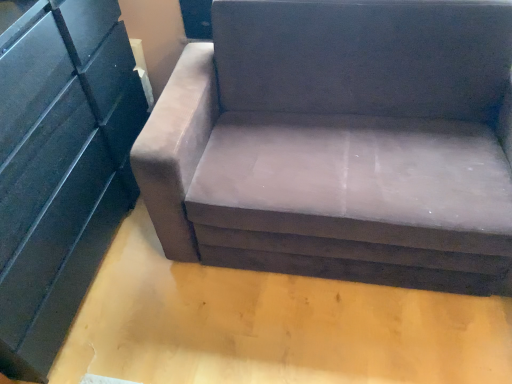
Question: Does suede-like brown couch at center have a smaller size compared to matte black dresser at left?

Choices:
 (A) yes
 (B) no

Answer: (B)

Question: From a real-world perspective, is suede-like brown couch at center located higher than matte black dresser at left?

Choices:
 (A) no
 (B) yes

Answer: (A)

Question: Is suede-like brown couch at center oriented away from matte black dresser at left?

Choices:
 (A) no
 (B) yes

Answer: (A)

Question: From the image's perspective, is suede-like brown couch at center located above matte black dresser at left?

Choices:
 (A) no
 (B) yes

Answer: (B)

Question: Is suede-like brown couch at center thinner than matte black dresser at left?

Choices:
 (A) no
 (B) yes

Answer: (A)

Question: Considering the relative positions of suede-like brown couch at center and matte black dresser at left in the image provided, is suede-like brown couch at center to the left of matte black dresser at left from the viewer's perspective?

Choices:
 (A) yes
 (B) no

Answer: (B)

Question: Can you confirm if matte black dresser at left is wider than suede-like brown couch at center?

Choices:
 (A) yes
 (B) no

Answer: (B)

Question: Is matte black dresser at left at the right side of suede-like brown couch at center?

Choices:
 (A) yes
 (B) no

Answer: (B)

Question: Can we say matte black dresser at left lies outside suede-like brown couch at center?

Choices:
 (A) yes
 (B) no

Answer: (A)

Question: Is matte black dresser at left facing towards suede-like brown couch at center?

Choices:
 (A) yes
 (B) no

Answer: (A)

Question: Does matte black dresser at left have a lesser width compared to suede-like brown couch at center?

Choices:
 (A) no
 (B) yes

Answer: (B)

Question: Is matte black dresser at left facing away from suede-like brown couch at center?

Choices:
 (A) yes
 (B) no

Answer: (B)

Question: Does point (52, 59) appear closer or farther from the camera than point (260, 145)?

Choices:
 (A) closer
 (B) farther

Answer: (A)